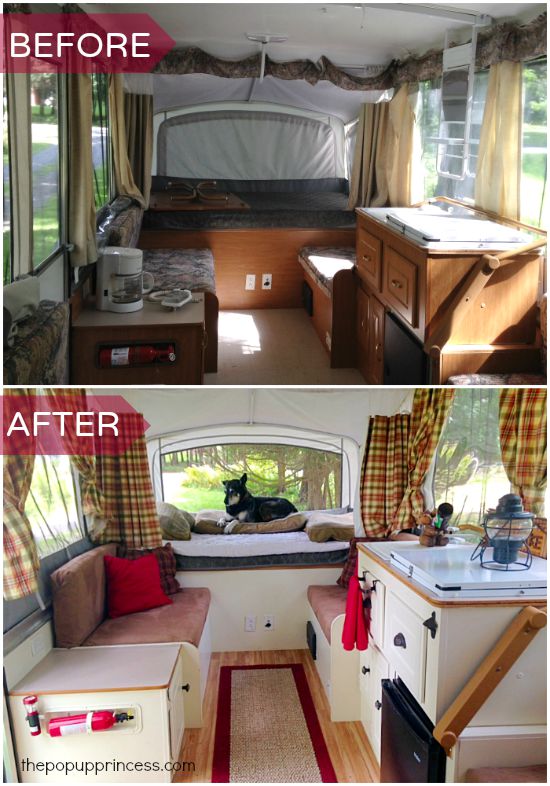
Identify the location of dog bed. (274, 520).